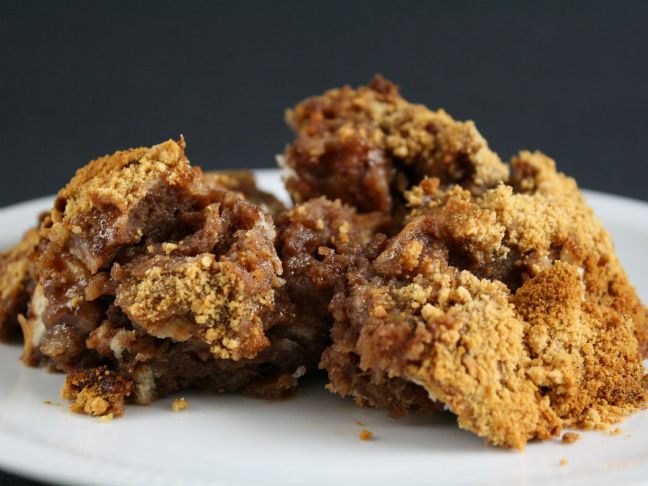
You are a GUI agent. You are given a task and a screenshot of the screen. Output one action in this format:
    pyautogui.click(x=<x>, y=<y>)
    Task: Click on the small crumbs
    This screenshot has height=486, width=648.
    Given the screenshot: What is the action you would take?
    pyautogui.click(x=359, y=419), pyautogui.click(x=564, y=461), pyautogui.click(x=612, y=433), pyautogui.click(x=621, y=433)